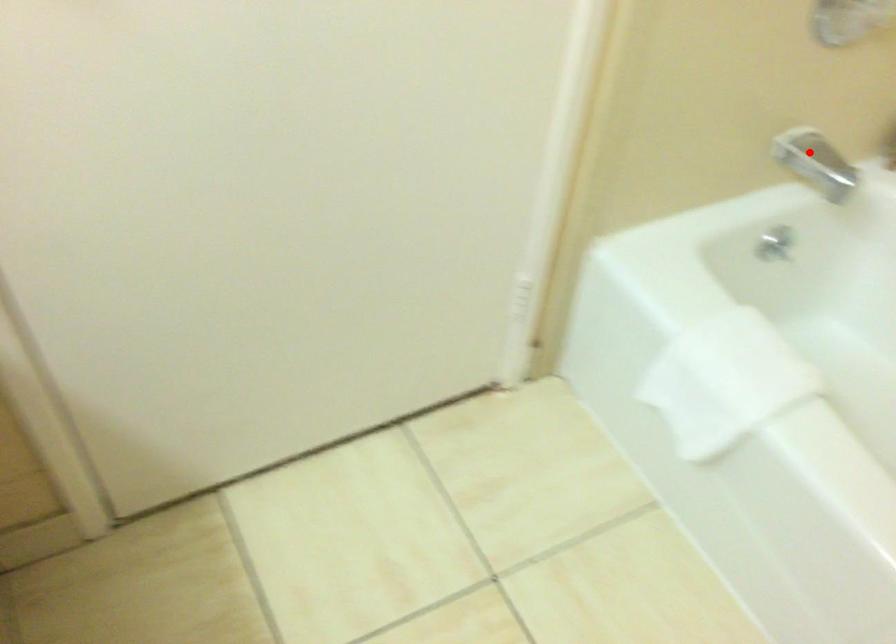
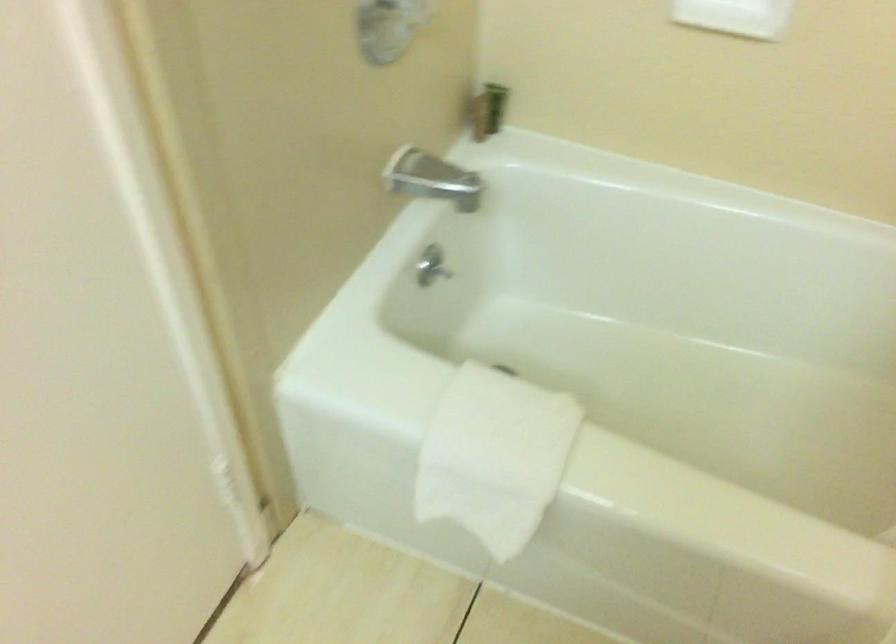
Question: I am providing you with two images of the same scene from different viewpoints. In image1, a red point is highlighted. Considering the same 3D point in image2, which of the following is correct?

Choices:
 (A) It is closer
 (B) It is farther

Answer: (A)